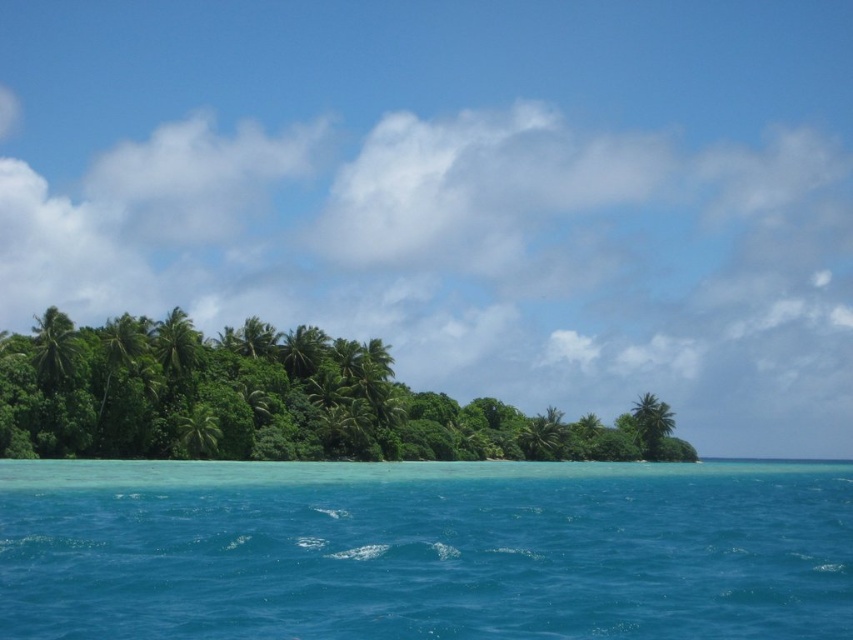
You are a bird flying over the tropical landscape. You see the clear blue water at center and the green leafy palm tree at center. Which one is directly above the other?

The green leafy palm tree at center is directly above the clear blue water at center because the water is positioned under the tree.